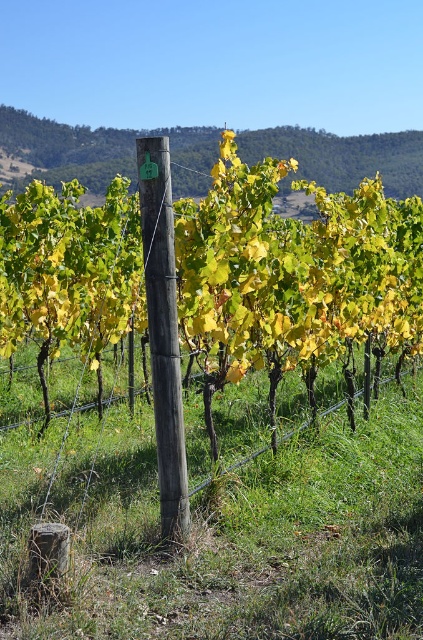
Can you confirm if wooden post at center is bigger than weathered wood post at center?

Correct, wooden post at center is larger in size than weathered wood post at center.

In the scene shown: Is wooden post at center to the left of weathered wood post at center from the viewer's perspective?

Indeed, wooden post at center is positioned on the left side of weathered wood post at center.

Does point (96, 140) come behind point (173, 369)?

Yes, it is behind point (173, 369).

At what (x,y) coordinates should I click in order to perform the action: click on wooden post at center. Please return your answer as a coordinate pair (x, y). The height and width of the screenshot is (640, 423). Looking at the image, I should click on (102, 150).